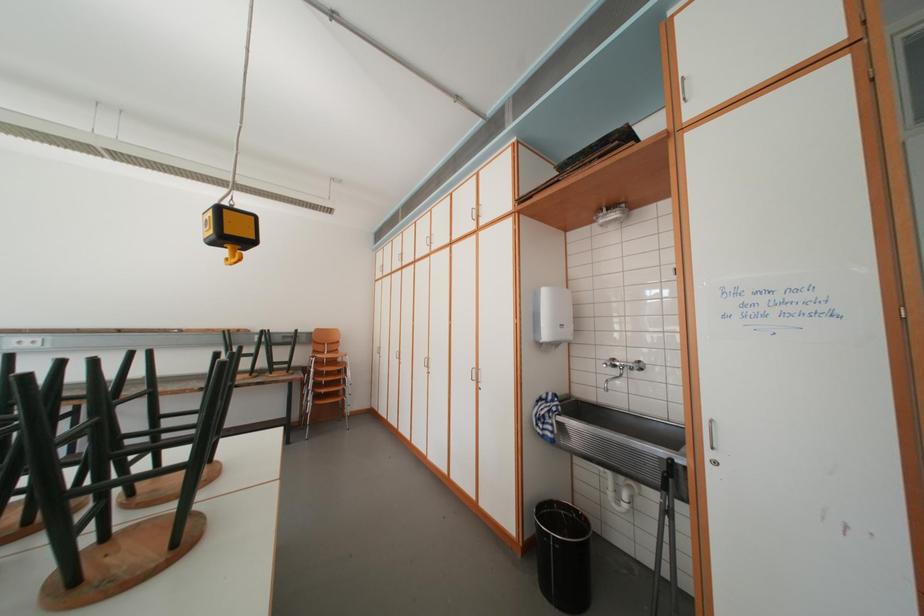
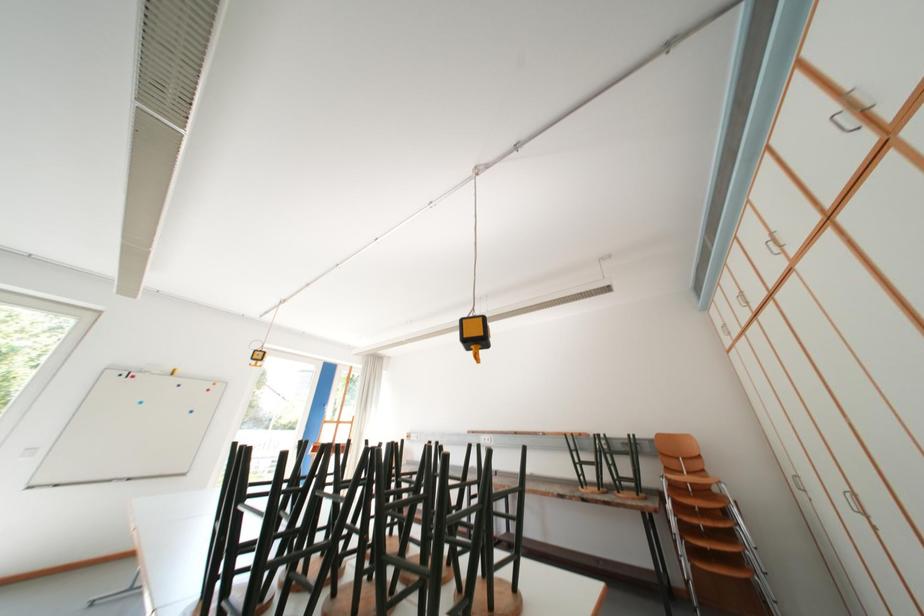
How did the camera likely rotate?

The camera rotated toward left-up.